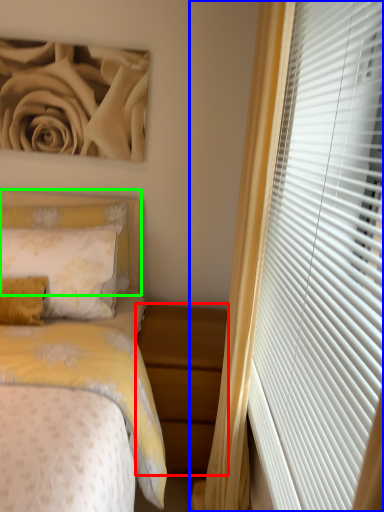
Question: Estimate the real-world distances between objects in this image. Which object is closer to nightstand (highlighted by a red box), curtain (highlighted by a blue box) or headboard (highlighted by a green box)?

Choices:
 (A) curtain
 (B) headboard

Answer: (A)